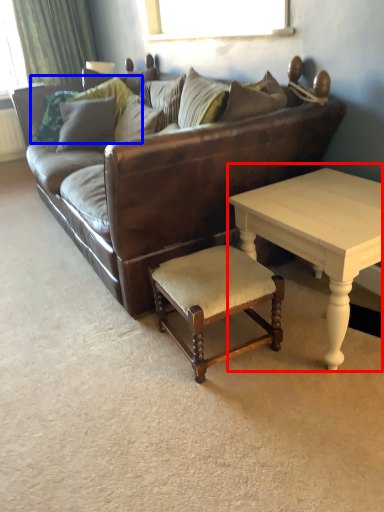
Question: Which object is further to the camera taking this photo, coffee table (highlighted by a red box) or pillow (highlighted by a blue box)?

Choices:
 (A) coffee table
 (B) pillow

Answer: (B)